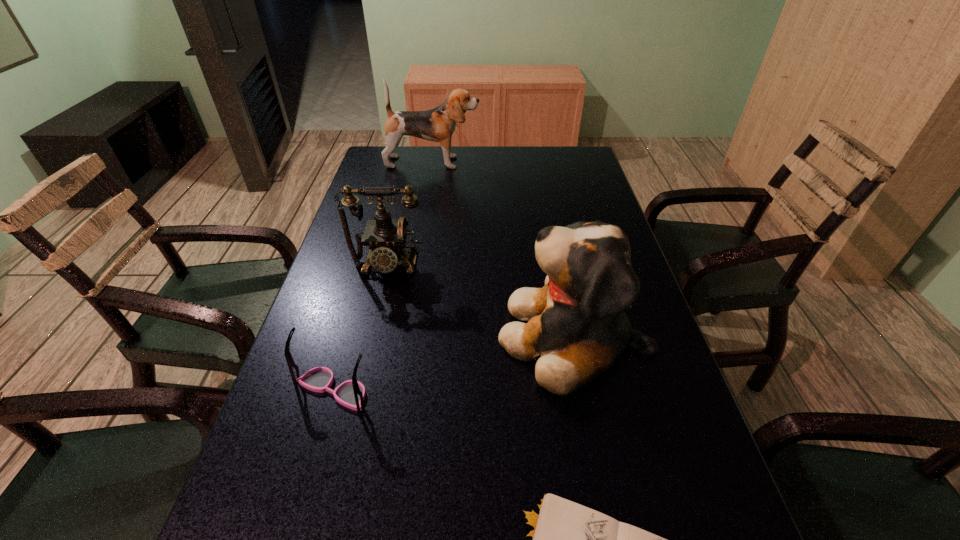
Where is `the left puppy`? the left puppy is located at coordinates (438, 124).

The width and height of the screenshot is (960, 540). In order to click on the farthest object in this screenshot , I will do `click(438, 124)`.

At what (x,y) coordinates should I click in order to perform the action: click on the nearer puppy. Please return your answer as a coordinate pair (x, y). The width and height of the screenshot is (960, 540). Looking at the image, I should click on (577, 329).

Where is `the fourth nearest object`? The image size is (960, 540). the fourth nearest object is located at coordinates (386, 238).

You are a GUI agent. You are given a task and a screenshot of the screen. Output one action in this format:
    pyautogui.click(x=<x>, y=<y>)
    Task: Click on the third tallest object
    The image size is (960, 540).
    Given the screenshot: What is the action you would take?
    pyautogui.click(x=386, y=238)

You are a GUI agent. You are given a task and a screenshot of the screen. Output one action in this format:
    pyautogui.click(x=<x>, y=<y>)
    Task: Click on the second shortest object
    This screenshot has width=960, height=540.
    Given the screenshot: What is the action you would take?
    pyautogui.click(x=351, y=393)

The width and height of the screenshot is (960, 540). In order to click on free space located 0.150m at the face of the left puppy in this screenshot , I will do `click(522, 163)`.

Image resolution: width=960 pixels, height=540 pixels. In order to click on free spot located 0.310m at the face of the nearer puppy in this screenshot , I will do `click(354, 337)`.

The width and height of the screenshot is (960, 540). Identify the location of vacant point located at the face of the nearer puppy. (396, 337).

At what (x,y) coordinates should I click in order to perform the action: click on free space located at the face of the nearer puppy. Please return your answer as a coordinate pair (x, y). This screenshot has width=960, height=540. Looking at the image, I should click on (400, 337).